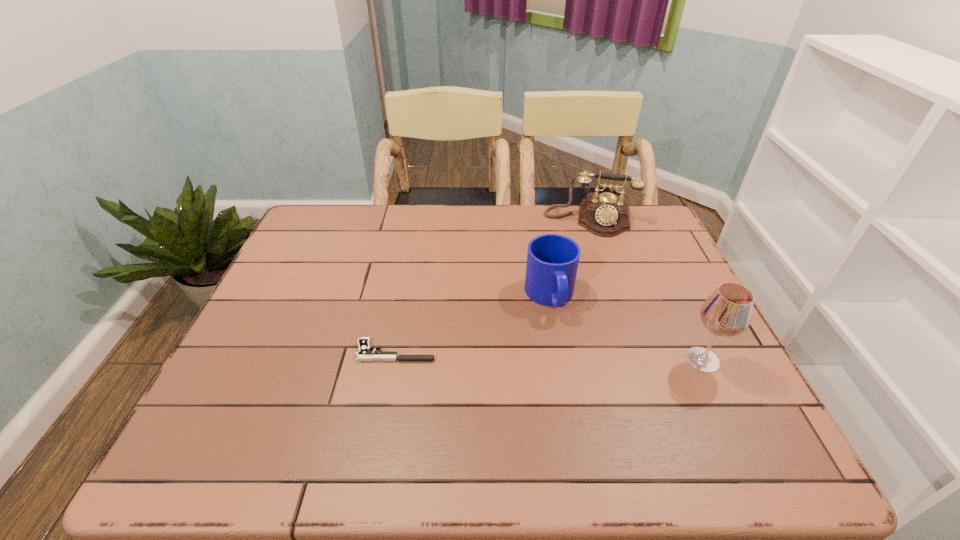
Identify the location of free space on the desktop that is between the shortest object and the wineglass and is positioned on the dial of the telephone. (581, 356).

This screenshot has width=960, height=540. I want to click on vacant spot on the desktop that is between the leftmost object and the tallest object and is positioned on the side with the handle of the third tallest object, so click(x=569, y=356).